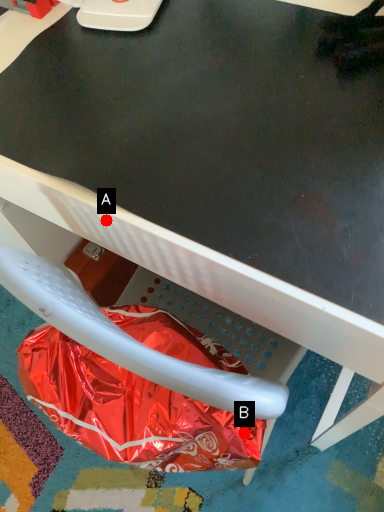
Question: Two points are circled on the image, labeled by A and B beside each circle. Which point is further to the camera?

Choices:
 (A) A is further
 (B) B is further

Answer: (B)